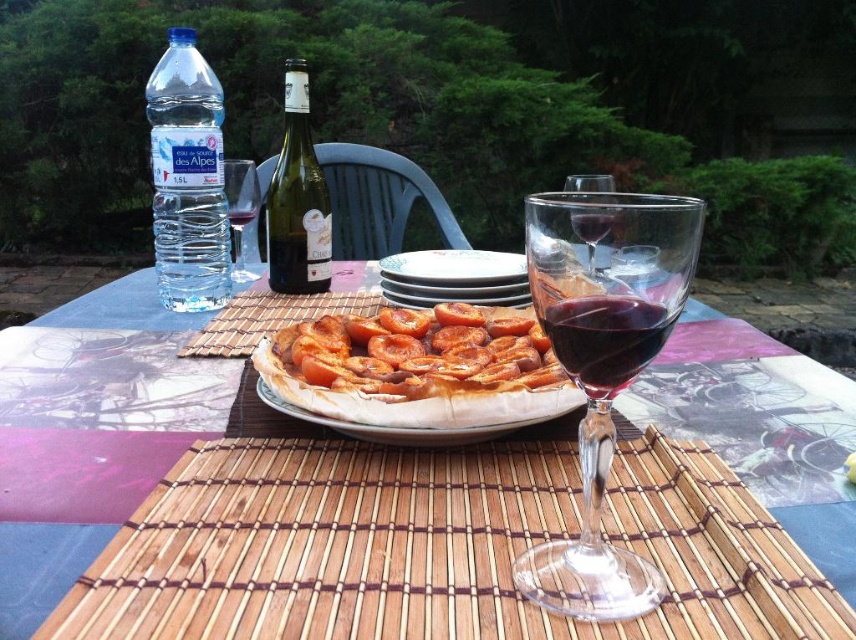
Question: Considering the relative positions of transparent plastic bottle at upper left and transparent glass at center in the image provided, where is transparent plastic bottle at upper left located with respect to transparent glass at center?

Choices:
 (A) below
 (B) above

Answer: (B)

Question: Which of the following is the farthest from the observer?

Choices:
 (A) (443, 282)
 (B) (247, 216)

Answer: (B)

Question: Which of the following is the closest to the observer?

Choices:
 (A) transparent glass wine at upper right
 (B) transparent plastic bottle at upper left
 (C) clear glass wine glass at left

Answer: (B)

Question: Is the position of transparent glass wine glass at center less distant than that of transparent glass wine at upper right?

Choices:
 (A) no
 (B) yes

Answer: (B)

Question: Which point appears farthest from the camera in this image?

Choices:
 (A) (432, 342)
 (B) (586, 182)
 (C) (230, 172)

Answer: (C)

Question: Observing the image, what is the correct spatial positioning of translucent glass table at center in reference to transparent glass wine at upper right?

Choices:
 (A) right
 (B) left

Answer: (B)